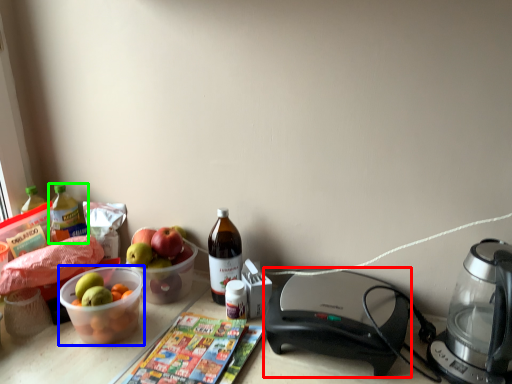
Question: Estimate the real-world distances between objects in this image. Which object is farther from appliance (highlighted by a red box), bowl (highlighted by a blue box) or bottle (highlighted by a green box)?

Choices:
 (A) bowl
 (B) bottle

Answer: (B)